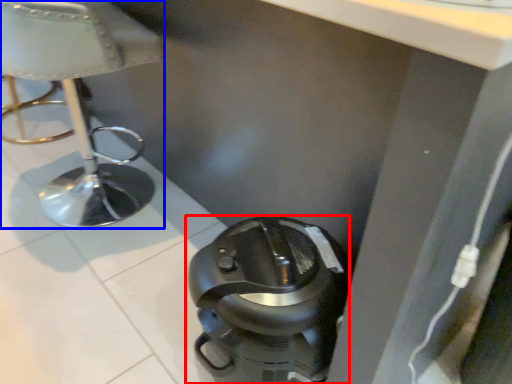
Question: Which object is closer to the camera taking this photo, home appliance (highlighted by a red box) or furniture (highlighted by a blue box)?

Choices:
 (A) home appliance
 (B) furniture

Answer: (A)